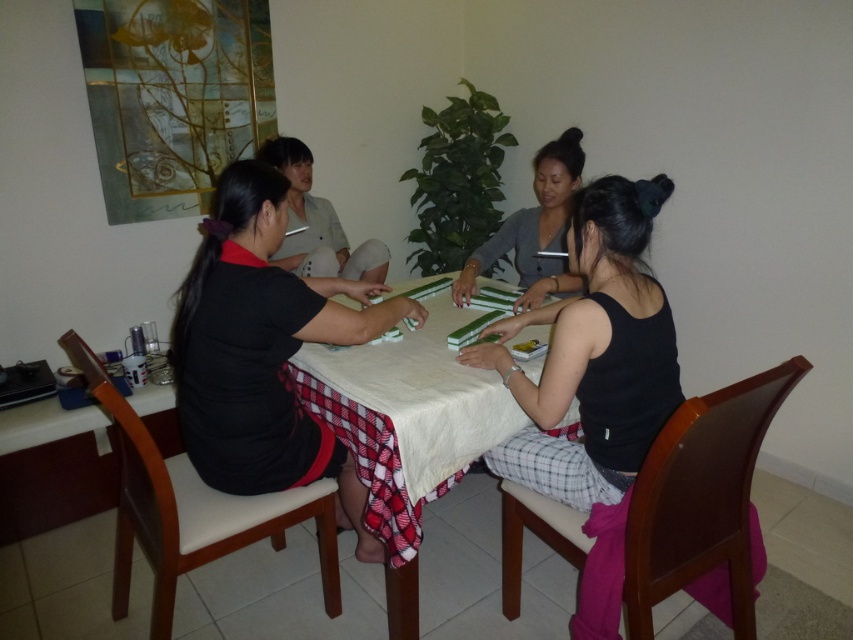
In the scene shown: You are a tailor measuring clothes for two people sitting at the table. The black matte tank top at lower right and the matte gray shirt at upper center are both on the table. Which one is wider?

The black matte tank top at lower right is wider than the matte gray shirt at upper center because the black matte tank top at lower right has a greater width.